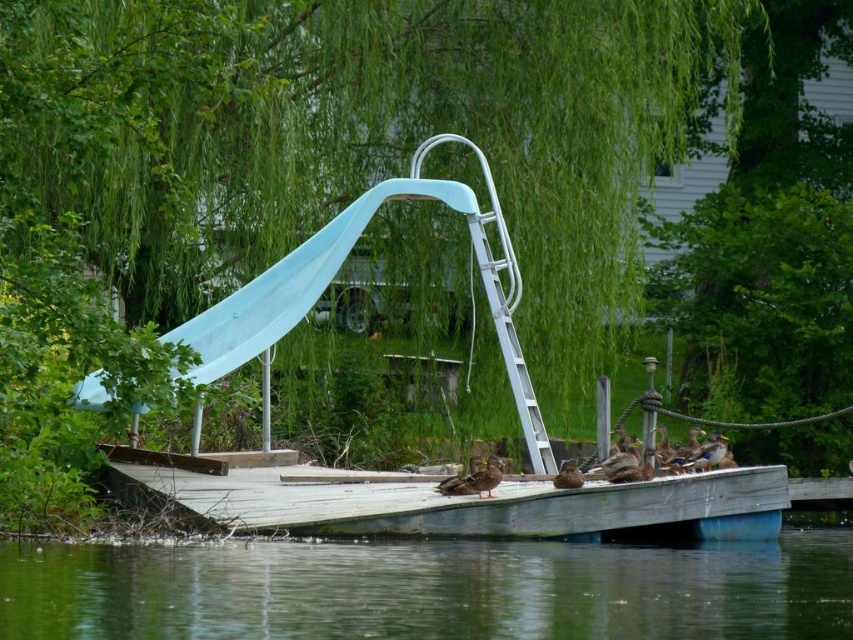
Does green leafy willow at upper center have a greater width compared to green water at lower center?

Yes.

Does point (167, 54) come in front of point (45, 582)?

No.

Image resolution: width=853 pixels, height=640 pixels. I want to click on green leafy willow at upper center, so click(x=350, y=125).

Does wooden dock at lower center appear over blue rubber slide at upper center?

Incorrect, wooden dock at lower center is not positioned above blue rubber slide at upper center.

Between wooden dock at lower center and blue rubber slide at upper center, which one is positioned higher?

Positioned higher is blue rubber slide at upper center.

What do you see at coordinates (451, 500) in the screenshot? The image size is (853, 640). I see `wooden dock at lower center` at bounding box center [451, 500].

Where is `wooden dock at lower center`? wooden dock at lower center is located at coordinates pos(451,500).

Who is taller, green water at lower center or blue rubber slide at upper center?

blue rubber slide at upper center is taller.

I want to click on green water at lower center, so click(430, 589).